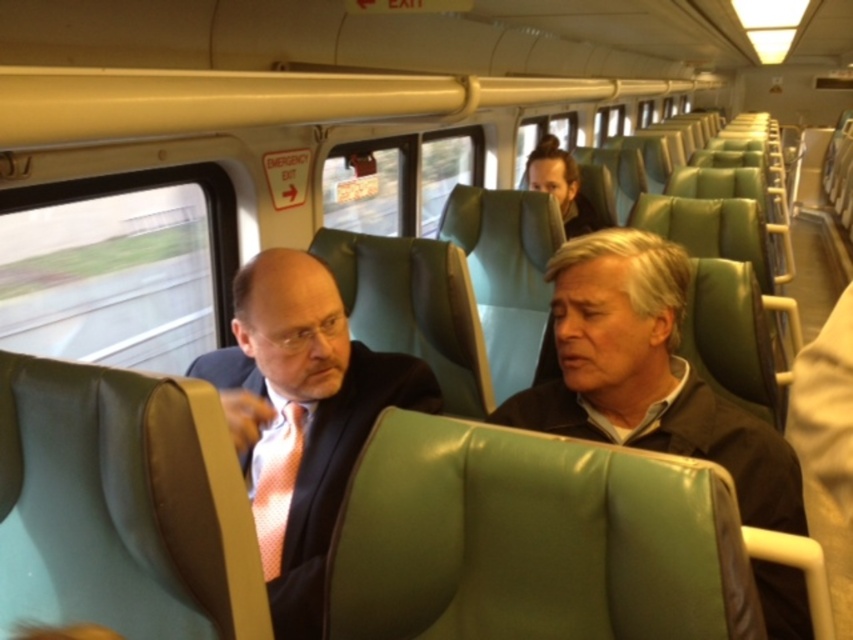
You are a passenger on the train and want to know if the matte black suit at center is covering the pink dotted tie at center. Can you determine this based on their positions?

The matte black suit at center is positioned over the pink dotted tie at center, so yes, the matte black suit at center is covering the pink dotted tie at center.

Consider the image. You are a passenger sitting in the train car and notice two people at the center. The objects mentioned are the matte black suit at center and the pink dotted tie at center. Which object is positioned to the right of the other?

The matte black suit at center is to the right of the pink dotted tie at center.

You are a passenger on this train and want to know which of the two items, the matte black suit at center or the dark brown leather jacket at upper center, takes up more space in the seating area. Can you determine this based on their sizes?

The matte black suit at center is larger in size than the dark brown leather jacket at upper center, so it takes up more space in the seating area.